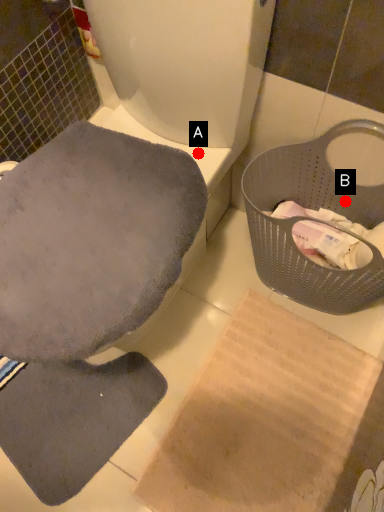
Question: Two points are circled on the image, labeled by A and B beside each circle. Which point is closer to the camera?

Choices:
 (A) A is closer
 (B) B is closer

Answer: (A)